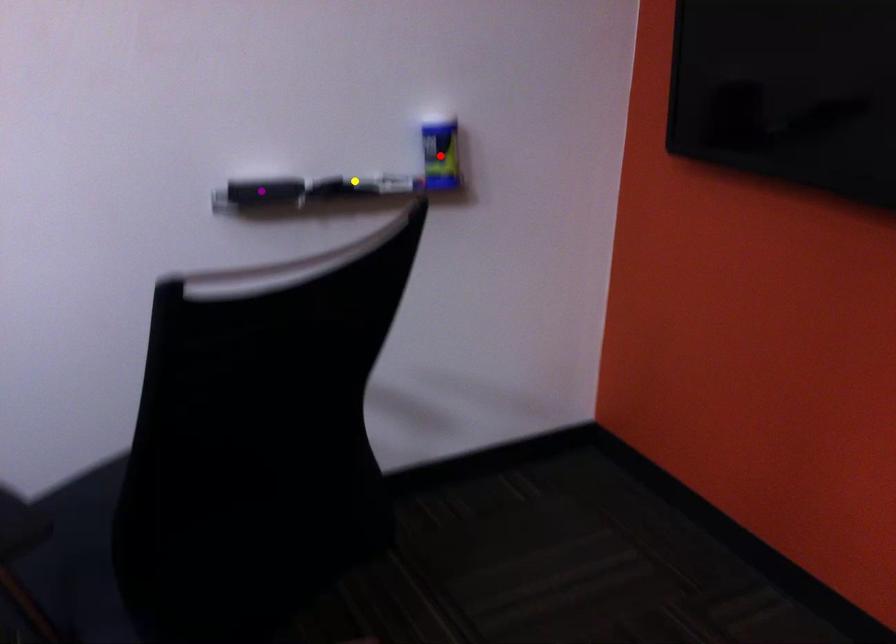
Order these from farthest to nearest:
1. purple point
2. yellow point
3. red point

1. red point
2. yellow point
3. purple point